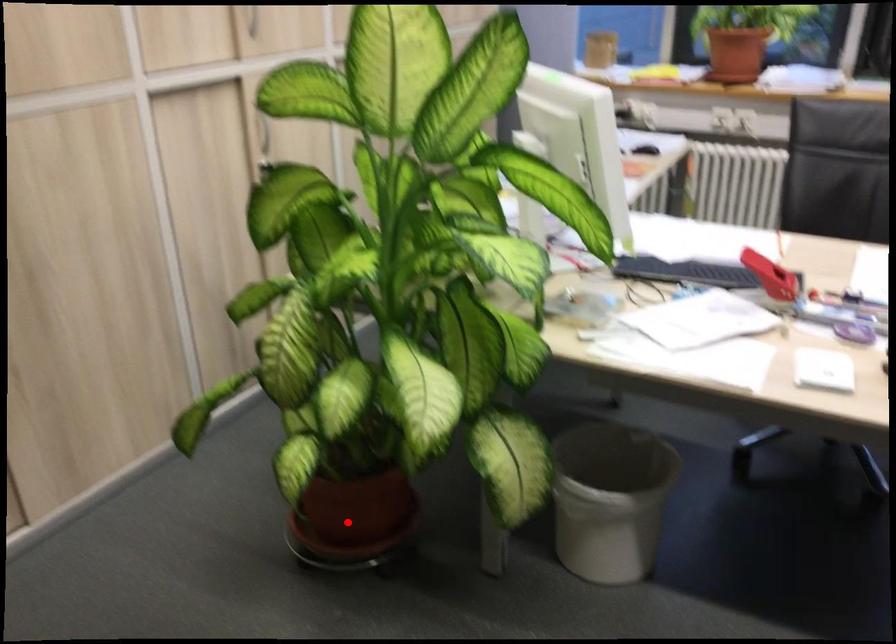
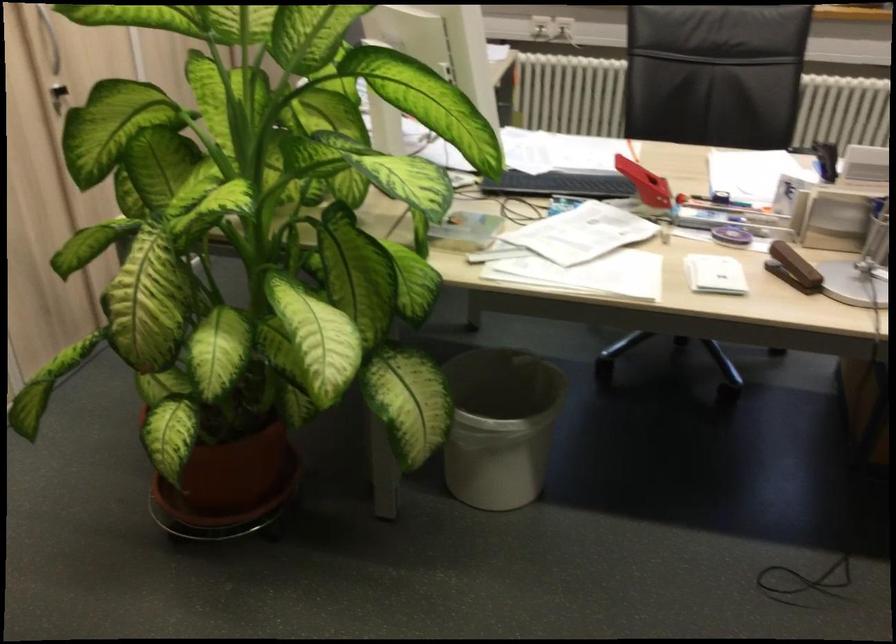
Locate, in the second image, the point that corresponds to the highlighted location in the first image.

(228, 487)